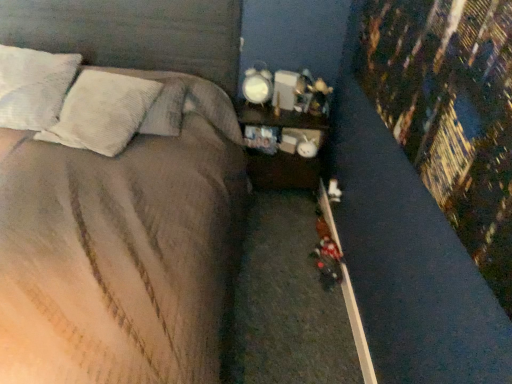
You are a GUI agent. You are given a task and a screenshot of the screen. Output one action in this format:
    pyautogui.click(x=<x>, y=<y>)
    Task: Click on the free point in front of white glossy alarm clock at upper right
    This screenshot has width=512, height=384.
    Given the screenshot: What is the action you would take?
    pyautogui.click(x=255, y=109)